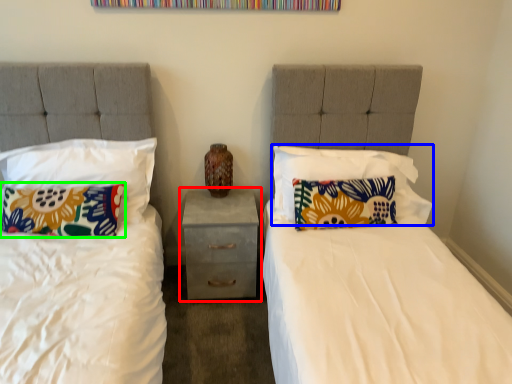
Question: Estimate the real-world distances between objects in this image. Which object is farther from nightstand (highlighted by a red box), pillow (highlighted by a blue box) or pillow (highlighted by a green box)?

Choices:
 (A) pillow
 (B) pillow

Answer: (B)